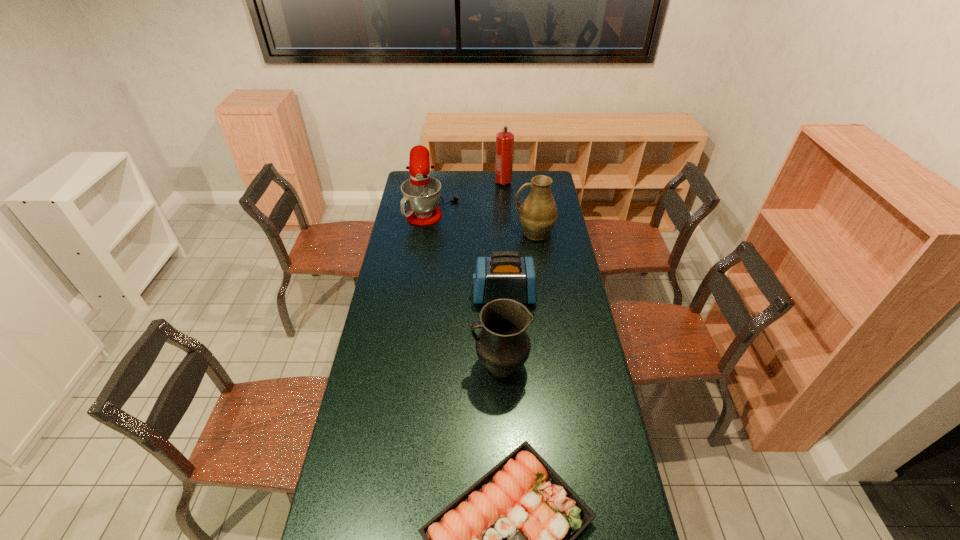
The height and width of the screenshot is (540, 960). What are the coordinates of `fire extinguisher` in the screenshot? It's located at (504, 140).

Identify the location of mixer. The image size is (960, 540). (421, 193).

Where is `the farther pitcher`? the farther pitcher is located at coordinates (538, 214).

The width and height of the screenshot is (960, 540). I want to click on the nearer pitcher, so click(502, 346).

You are a GUI agent. You are given a task and a screenshot of the screen. Output one action in this format:
    pyautogui.click(x=<x>, y=<y>)
    Task: Click on the toaster
    The image size is (960, 540).
    Given the screenshot: What is the action you would take?
    pyautogui.click(x=505, y=274)

You are a GUI agent. You are given a task and a screenshot of the screen. Output one action in this format:
    pyautogui.click(x=<x>, y=<y>)
    Task: Click on the third nearest object
    The height and width of the screenshot is (540, 960).
    Given the screenshot: What is the action you would take?
    pyautogui.click(x=505, y=274)

Where is `free space located on the handle side the fire extinguisher`? free space located on the handle side the fire extinguisher is located at coordinates (506, 220).

At what (x,y) coordinates should I click in order to perform the action: click on vacant space situated on the bowl side of the mixer. Please return your answer as a coordinate pair (x, y). The image size is (960, 540). Looking at the image, I should click on (527, 204).

This screenshot has height=540, width=960. Find the location of `vacant space located on the handle side of the farther pitcher`. vacant space located on the handle side of the farther pitcher is located at coordinates (498, 232).

Identify the location of vacant space located on the handle side of the farther pitcher. (489, 232).